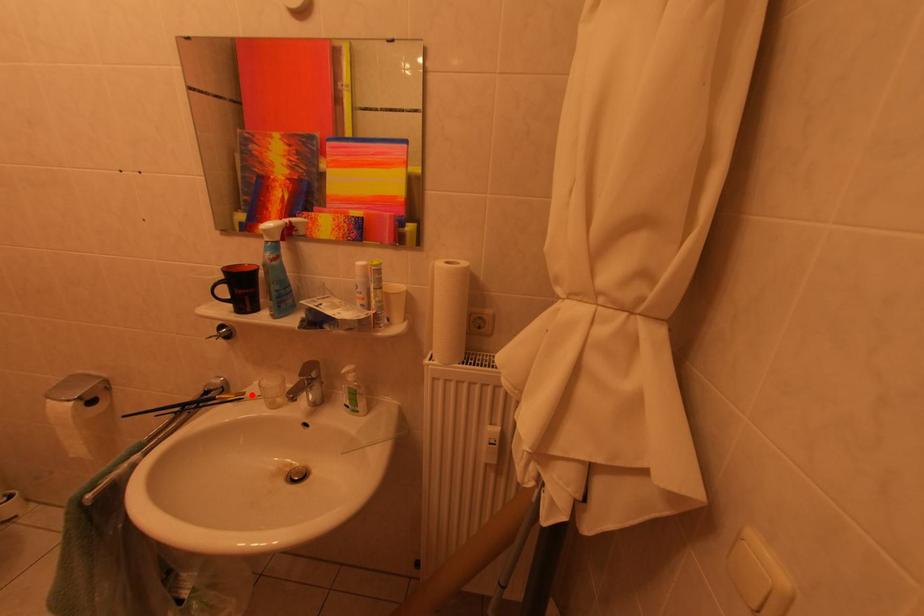
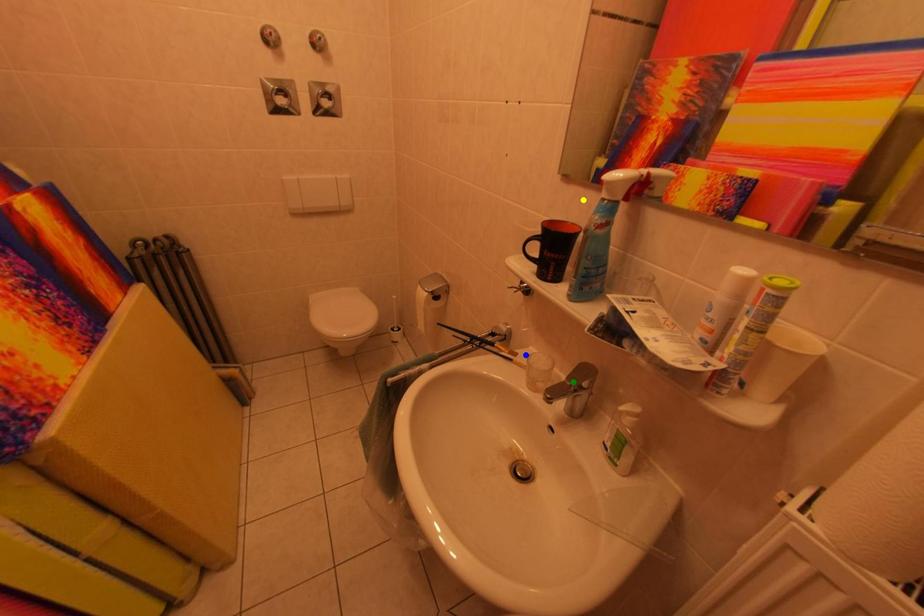
Question: I am providing you with two images of the same scene from different viewpoints. A red point is marked on the first image. You are given multiple points on the second image. Which point in image 2 is actually the same real-world point as the red point in image 1?

Choices:
 (A) yellow point
 (B) blue point
 (C) green point

Answer: (B)